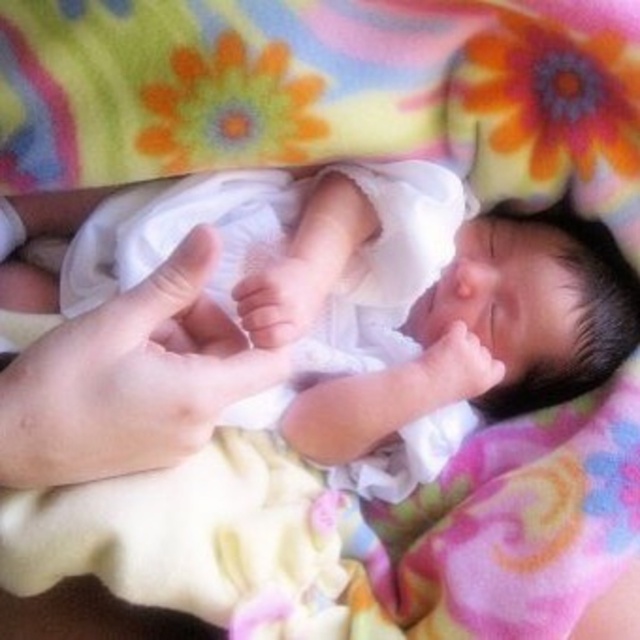
Question: Which point is farther to the camera?

Choices:
 (A) (406, 433)
 (B) (10, 394)

Answer: (A)

Question: Is white soft cloth at center to the right of smooth skin hand at lower left from the viewer's perspective?

Choices:
 (A) yes
 (B) no

Answer: (A)

Question: Which object is closer to the camera taking this photo?

Choices:
 (A) smooth skin hand at lower left
 (B) white soft cloth at center

Answer: (A)

Question: Observing the image, what is the correct spatial positioning of white soft cloth at center in reference to smooth skin hand at lower left?

Choices:
 (A) below
 (B) above

Answer: (B)

Question: Which object appears closest to the camera in this image?

Choices:
 (A) smooth skin hand at lower left
 (B) white soft cloth at center

Answer: (A)

Question: Can you confirm if white soft cloth at center is positioned to the left of smooth skin hand at lower left?

Choices:
 (A) yes
 (B) no

Answer: (B)